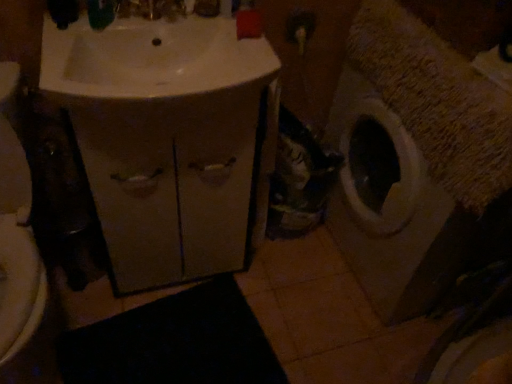
Question: Considering the positions of black rubber bath mat at lower center and matte beige cabinet at center in the image, is black rubber bath mat at lower center bigger or smaller than matte beige cabinet at center?

Choices:
 (A) small
 (B) big

Answer: (A)

Question: Does point (152, 316) appear closer or farther from the camera than point (176, 230)?

Choices:
 (A) closer
 (B) farther

Answer: (B)

Question: Which object is positioned closest to the textured beige washing machine at right?

Choices:
 (A) white glossy sink at upper left
 (B) matte beige cabinet at center
 (C) black rubber bath mat at lower center

Answer: (B)

Question: Which object is positioned farthest from the textured beige washing machine at right?

Choices:
 (A) white glossy sink at upper left
 (B) matte beige cabinet at center
 (C) black rubber bath mat at lower center

Answer: (C)